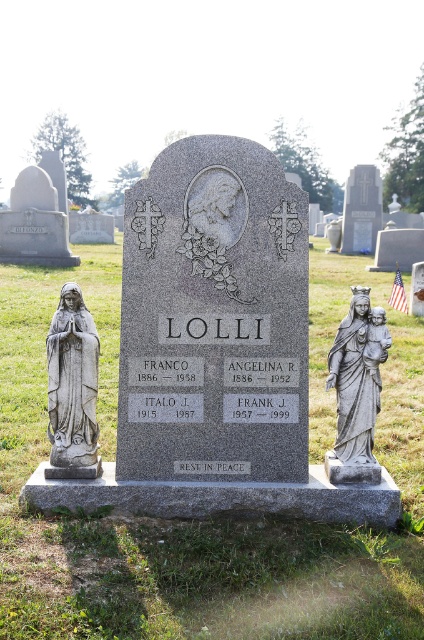
You are standing in front of the gravestone and want to place a bouquet of flowers between the gray stone statue at left and the gray stone statue of mary holding baby at right. Which statue should you place the flowers closer to to ensure they are centered between both statues?

The gray stone statue of mary holding baby at right is wider than the gray stone statue at left, so to center the bouquet between them, you should place the flowers closer to the gray stone statue at left.